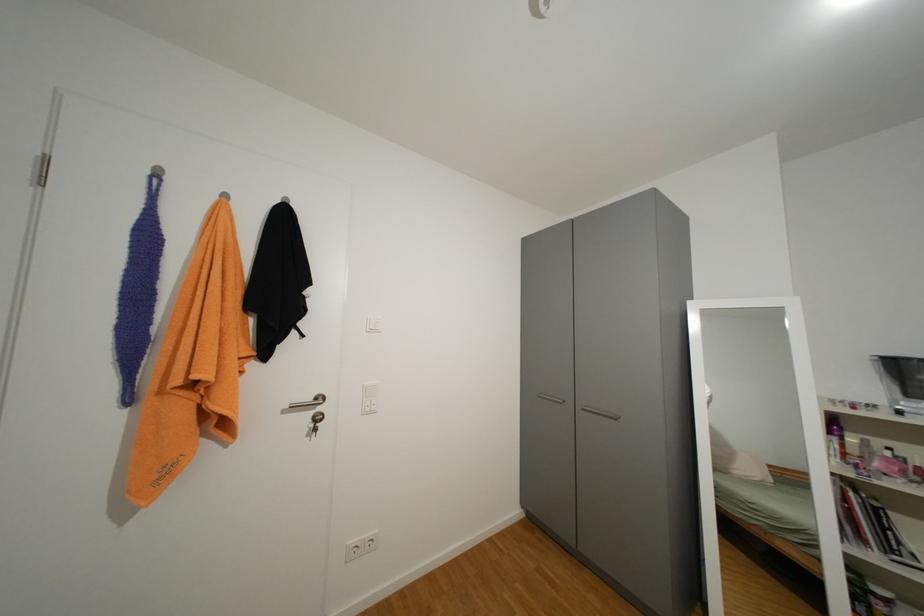
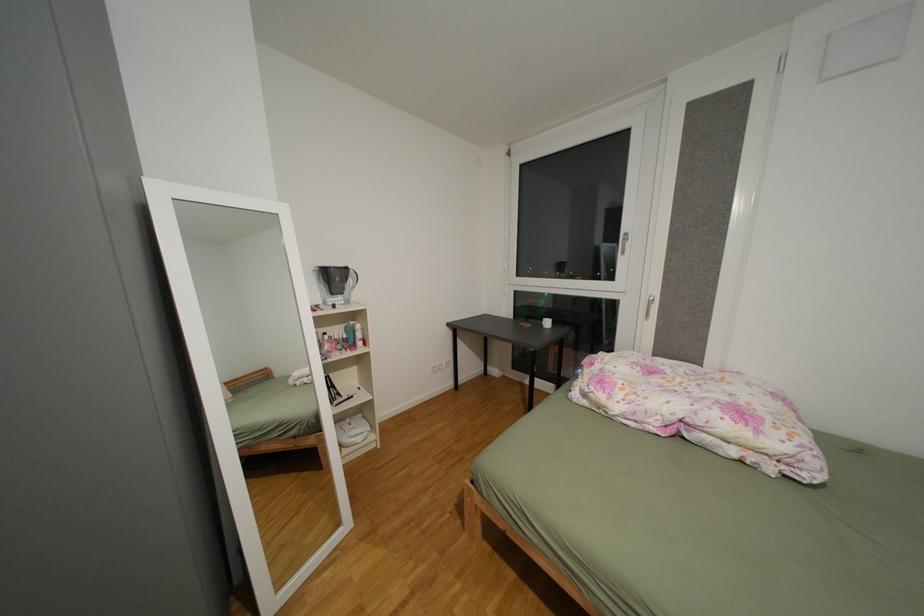
Question: The camera is either moving clockwise (left) or counter-clockwise (right) around the object. The first image is from the beginning of the video and the second image is from the end. Is the camera moving left or right when shooting the video?

Choices:
 (A) Left
 (B) Right

Answer: (A)